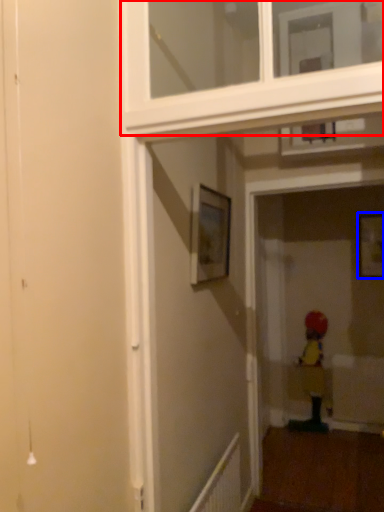
Question: Which of the following is the farthest to the observer, window frame (highlighted by a red box) or picture frame (highlighted by a blue box)?

Choices:
 (A) window frame
 (B) picture frame

Answer: (B)